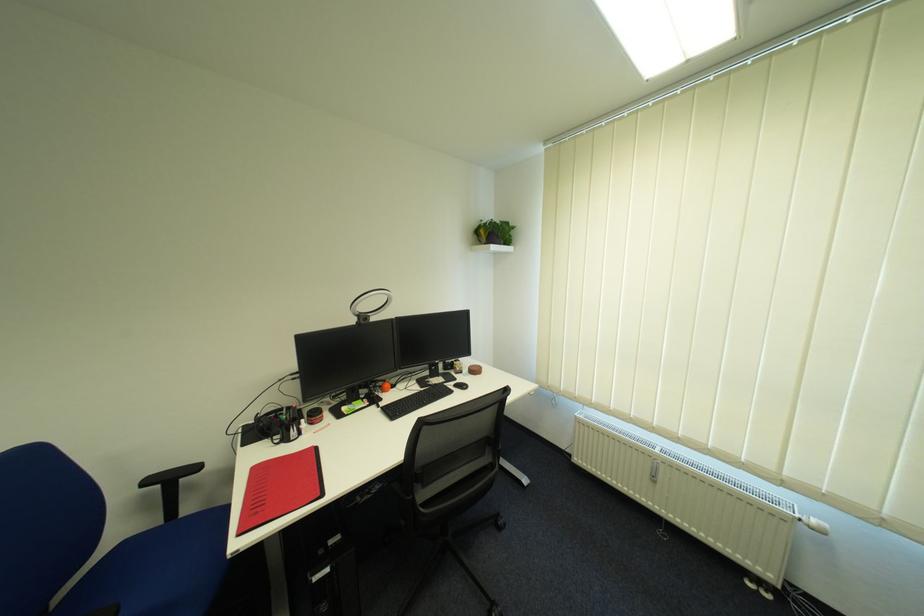
Where is `black chair armrest`? The height and width of the screenshot is (616, 924). black chair armrest is located at coordinates pos(399,480).